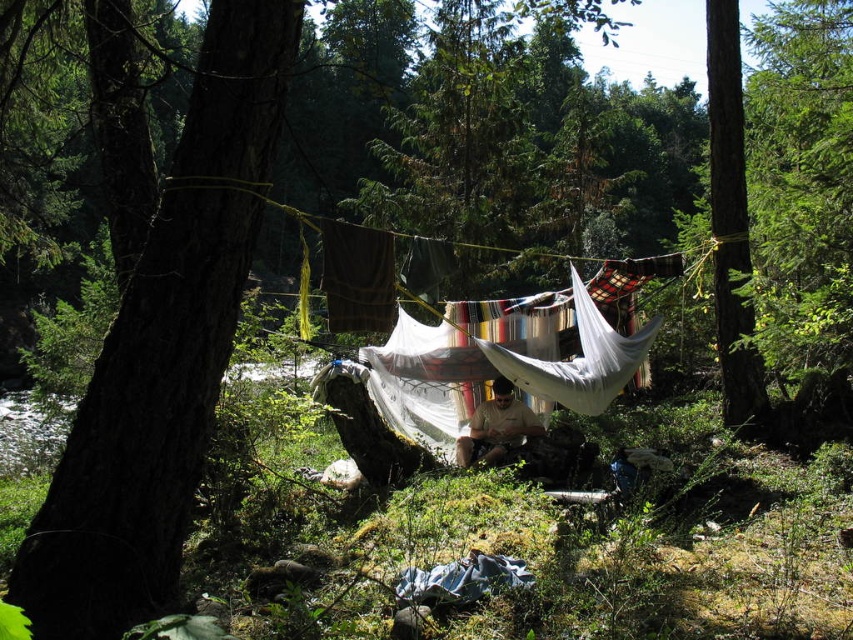
You are setting up a tent between the brown rough bark tree at left and the green rough bark tree at right. Which tree should you place the tent closer to if you want it to be sheltered from the wind coming from the taller tree?

You should place the tent closer to the brown rough bark tree at left because it is shorter than the green rough bark tree at right, providing better shelter from the wind coming from the taller tree.

You are setting up a tent between the brown rough bark tree at left and the green rough bark tree at right. Which tree will cast a shadow over the tent first in the morning?

The brown rough bark tree at left will cast a shadow over the tent first in the morning because it is positioned under the green rough bark tree at right, meaning it is closer to the east where the sun rises.